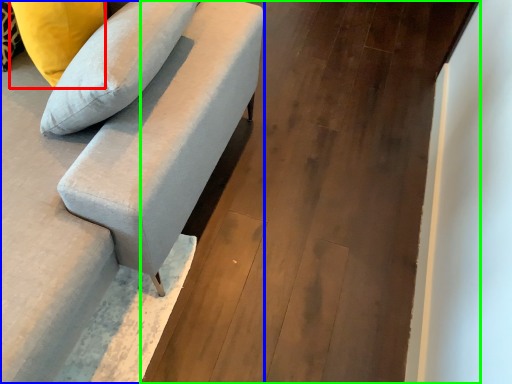
Question: Based on their relative distances, which object is farther from pillow (highlighted by a red box)? Choose from studio couch (highlighted by a blue box) and concrete (highlighted by a green box).

Choices:
 (A) studio couch
 (B) concrete

Answer: (B)